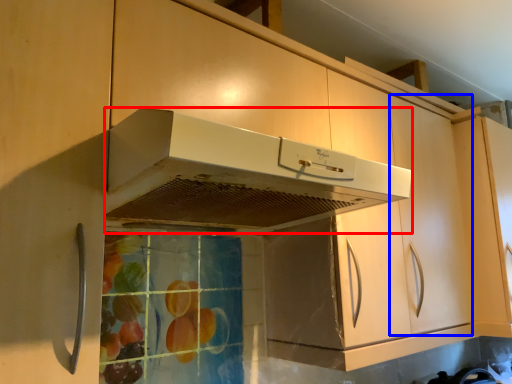
Question: Which point is closer to the camera, home appliance (highlighted by a red box) or cabinetry (highlighted by a blue box)?

Choices:
 (A) home appliance
 (B) cabinetry

Answer: (A)